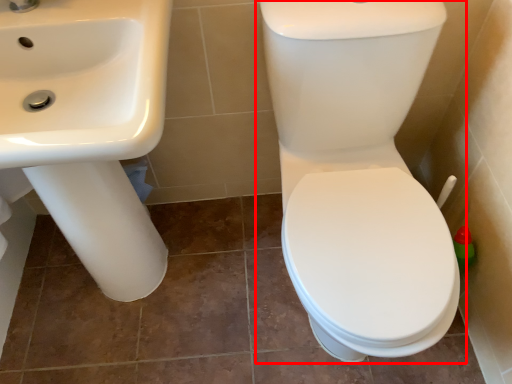
Question: From the image's perspective, what is the correct spatial positioning of toilet (annotated by the red box) in reference to sink?

Choices:
 (A) above
 (B) below

Answer: (B)